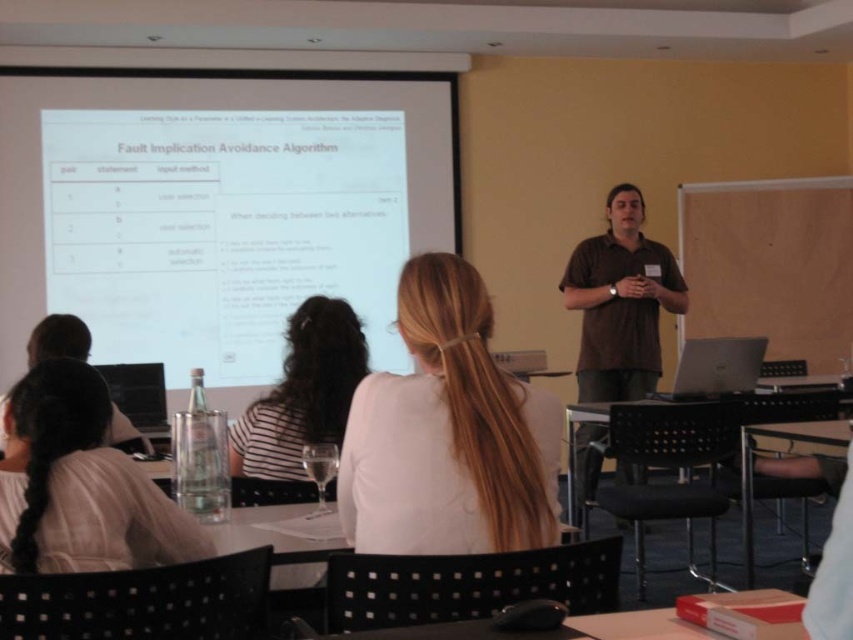
You are a student sitting at the front row and need to quickly grab a laptop. You have the silver metallic laptop at lower right and the matte black laptop at center. Which one is closer to you?

The silver metallic laptop at lower right is 2.44 meters away from the matte black laptop at center. Since you are sitting at the front row, the matte black laptop at center is closer to you than the silver metallic laptop at lower right.

You are standing in the classroom and want to reach the point at coordinates point (x=39, y=531). If you can walk 5 feet forward, will you be able to reach it?

The point (x=39, y=531) is 4.78 feet from viewer. Since you can walk 5 feet forward, you can reach it.

Based on the photo, you are a student sitting at the front row of the classroom. You want to grab the clear glass water at lower left to take a sip. However, you notice the matte black laptop at center is in your way. Can you reach the water without moving the laptop?

The clear glass water at lower left is shorter than the matte black laptop at center. Since the laptop is taller, it might block your access to the water. You may need to move the laptop to reach the water.